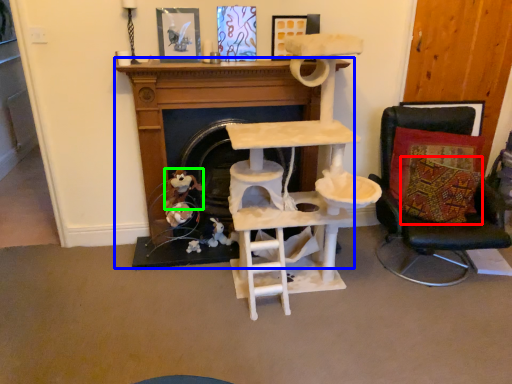
Question: Based on their relative distances, which object is farther from pillow (highlighted by a red box)? Choose from fireplace (highlighted by a blue box) and toy (highlighted by a green box).

Choices:
 (A) fireplace
 (B) toy

Answer: (B)